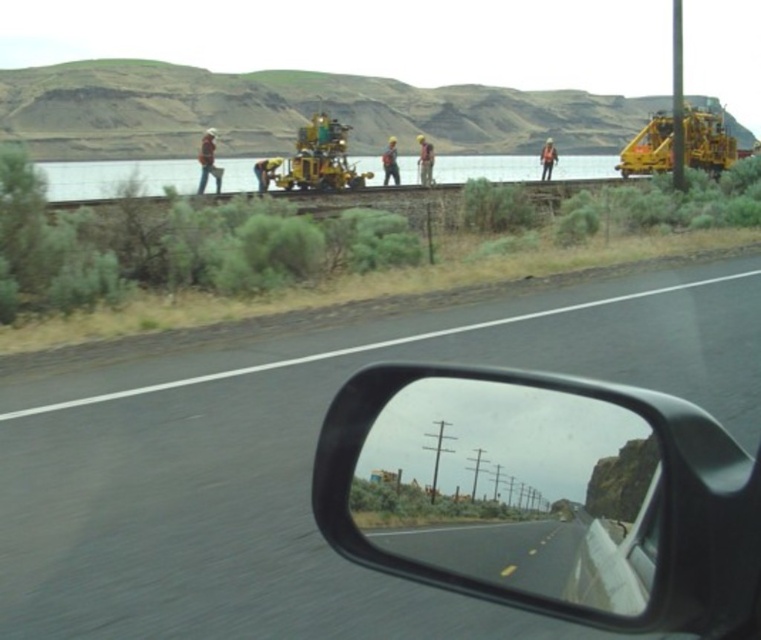
You are a driver approaching the black asphalt road at center and the smooth reflective mirror at center. Which object is closer to you as you drive forward?

The smooth reflective mirror at center is closer to you because the black asphalt road at center is further away, as stated in the description.